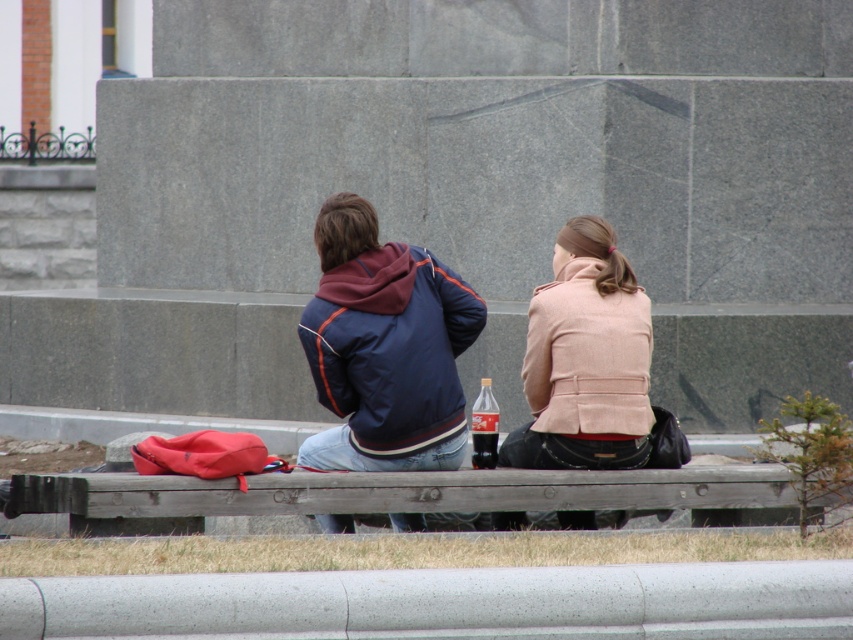
You are a park ranger who needs to ensure safety distances between visitors and the monument. The minimum safe distance required is 36 inches. Are the wooden bench at center and the translucent plastic soda can at center violating the safety rule?

The wooden bench at center is 35.33 inches from the translucent plastic soda can at center, which is less than the required 36 inches. Therefore, they are violating the safety rule.

You are standing in front of the stone structure and see two people sitting on a bench. You need to deliver a package to the person wearing the beige woolen coat at center. Which direction should you walk relative to the matte blue jacket at center to reach them?

The beige woolen coat at center is to the right of the matte blue jacket at center, so you should walk to the right side of the matte blue jacket at center to reach the person wearing the beige woolen coat at center.